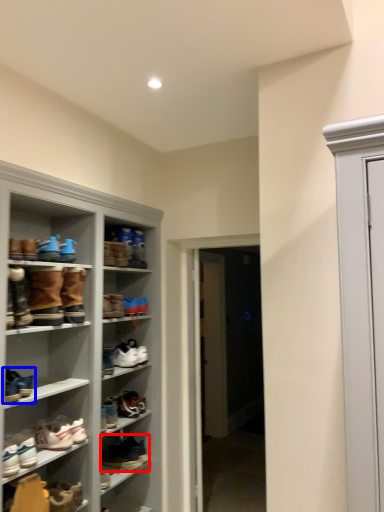
Question: Which of the following is the farthest to the observer, footwear (highlighted by a red box) or footwear (highlighted by a blue box)?

Choices:
 (A) footwear
 (B) footwear

Answer: (A)